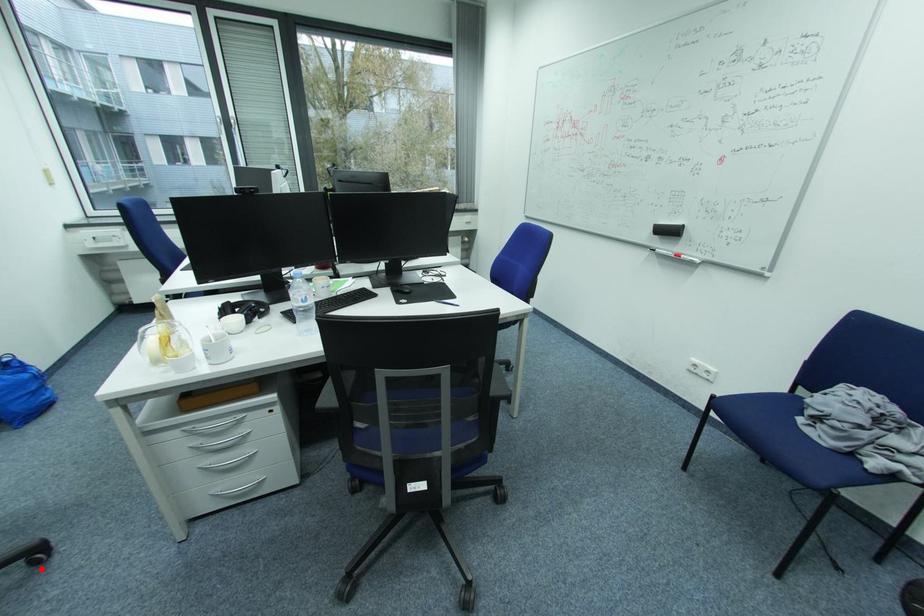
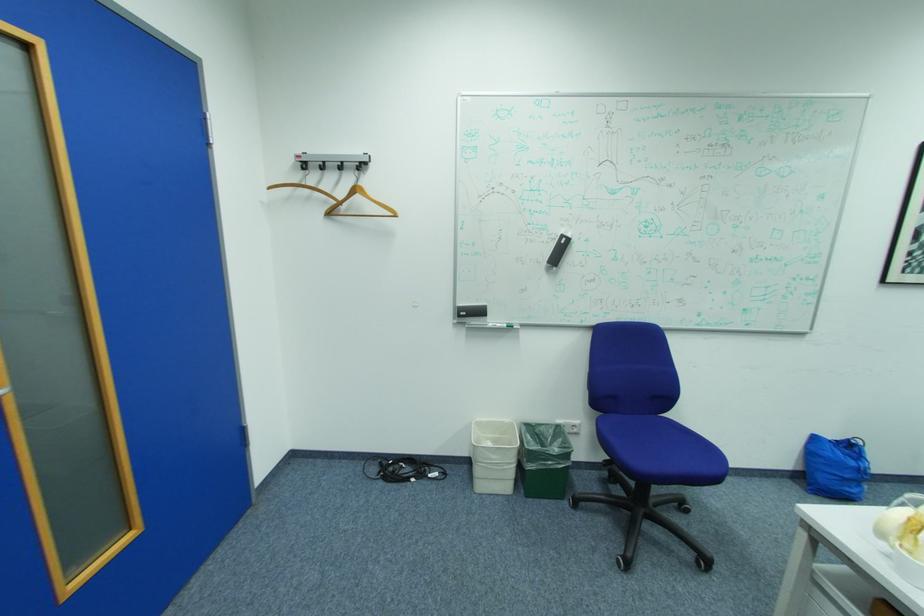
Question: I am providing you with two images of the same scene from different viewpoints. In image1, a red point is highlighted. Considering the same 3D point in image2, which of the following is correct?

Choices:
 (A) It is closer
 (B) It is farther

Answer: (B)